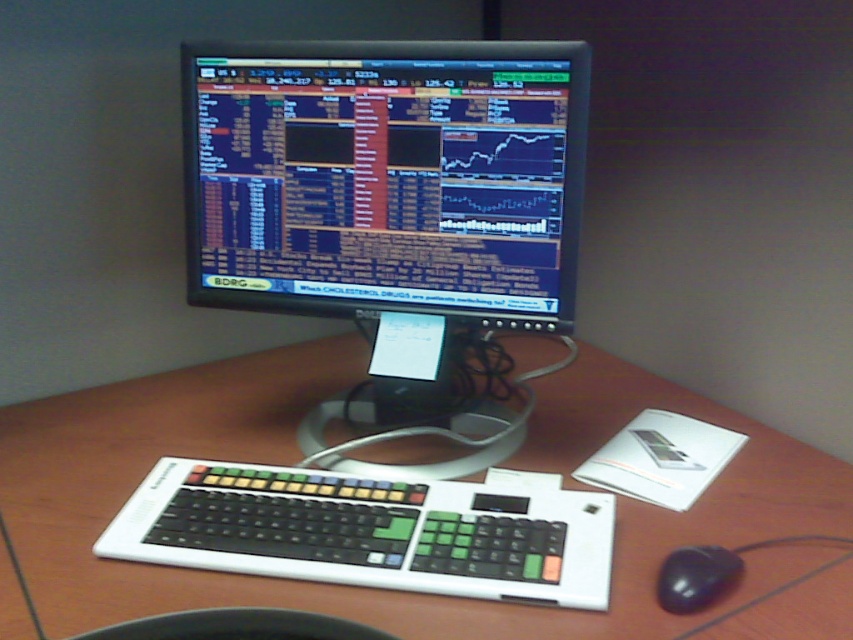
You are a trader working in a financial office. You need to access the keyboard located at point (370,531). However, your hand is currently at point 0.7, 0.5. Can you reach the keyboard without moving your arm? Please explain your reasoning based on the coordinates provided.

The keyboard is located at point (370,531), while your hand is at 0.7, 0.5. The distance between these points is approximately 0.13 units horizontally and 0.065 units vertically. Since the coordinates are normalized between 0 and 1, this distance is likely within arm reach for most people, so yes, you can reach the keyboard without moving your arm.

You are setting up a new desk and want to ensure there is enough vertical space between the black glossy monitor at center and the black plastic keyboard at lower center. If the monitor is taller than the keyboard, which object requires more vertical space?

The black glossy monitor at center requires more vertical space because it is taller than the black plastic keyboard at lower center.

You are organizing your desk and want to place a new item between the black plastic keyboard at lower center and the black plastic bowl at lower center. However, according to the scene description, can you actually place something between them?

The black plastic keyboard at lower center is positioned over black plastic bowl at lower center, so there is no space between them to place another item.